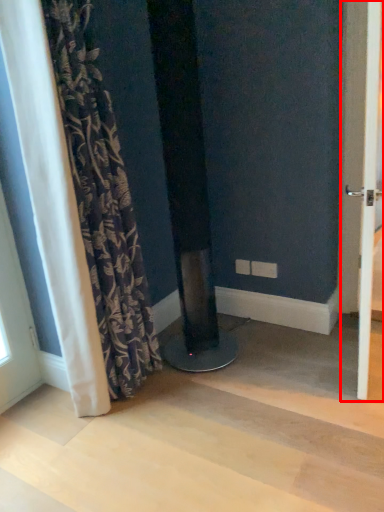
Question: From the image's perspective, where is screen door (annotated by the red box) located relative to curtain?

Choices:
 (A) below
 (B) above

Answer: (B)